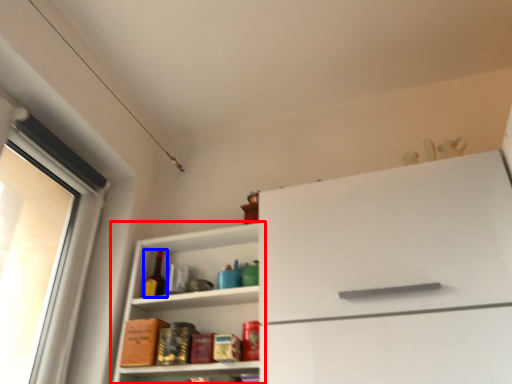
Question: Among these objects, which one is nearest to the camera, shelf (highlighted by a red box) or bottle (highlighted by a blue box)?

Choices:
 (A) shelf
 (B) bottle

Answer: (A)